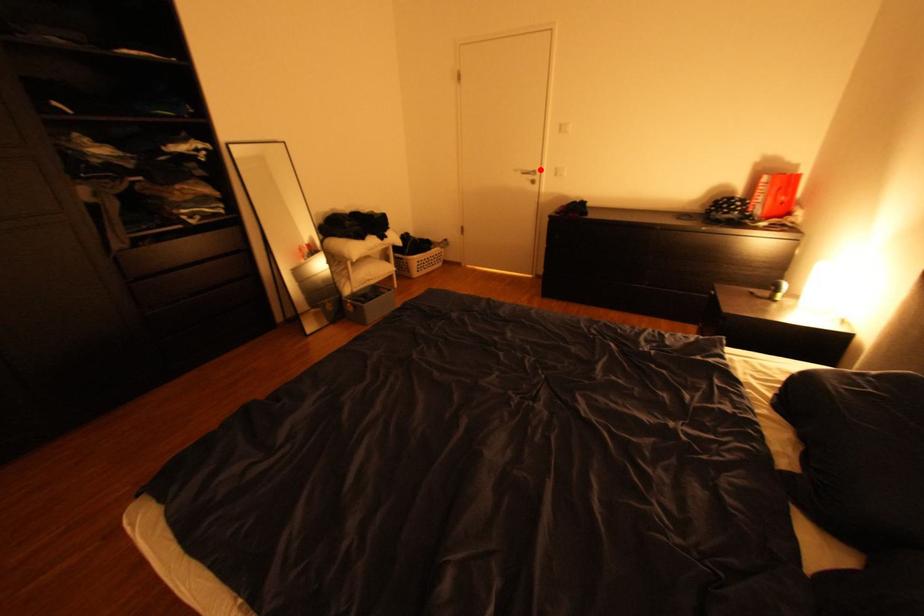
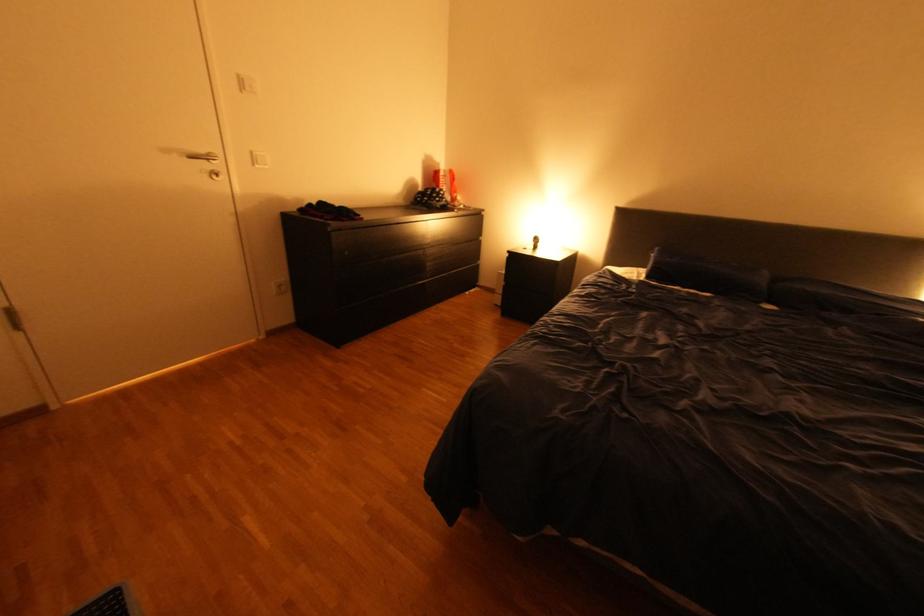
Question: I am providing you with two images of the same scene from different viewpoints. A red point is shown in image1. For the corresponding object point in image2, is it positioned nearer or farther from the camera?

Choices:
 (A) Nearer
 (B) Farther

Answer: (B)